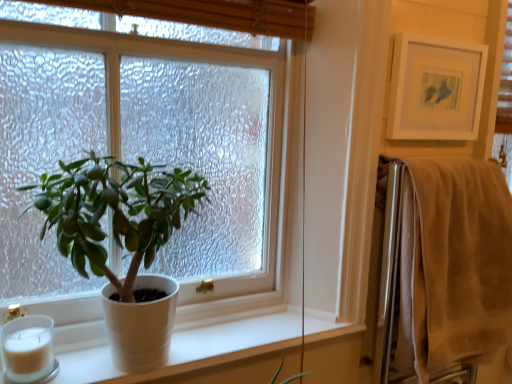
This screenshot has height=384, width=512. I want to click on vacant area located to the right-hand side of white matte candle at lower left, so click(94, 368).